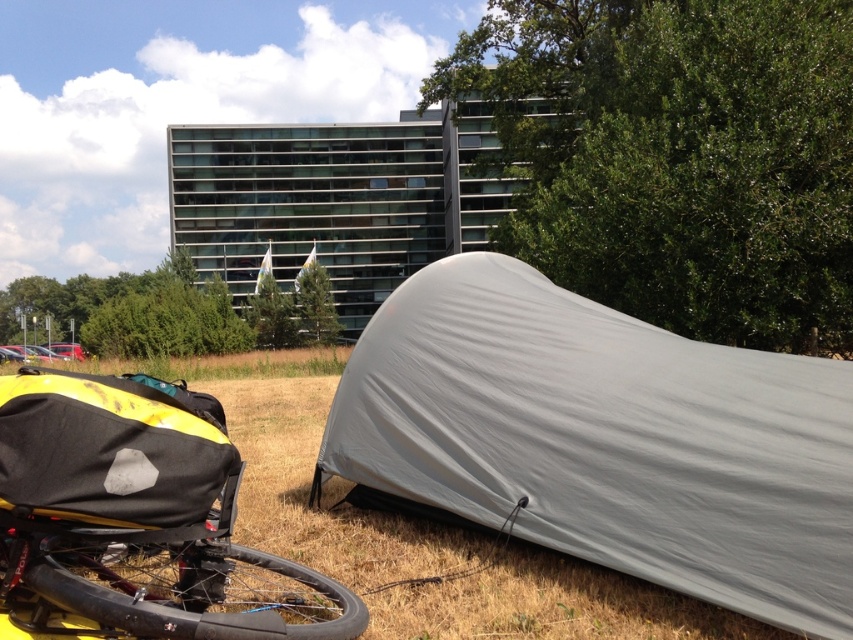
Question: Which object is farther from the camera taking this photo?

Choices:
 (A) gray fabric tent at lower right
 (B) green grass at lower center
 (C) yellow matte bicycle at lower left

Answer: (B)

Question: Among these objects, which one is farthest from the camera?

Choices:
 (A) gray fabric tent at lower right
 (B) green grass at lower center
 (C) black rubber tire at lower left

Answer: (B)

Question: Which point is closer to the camera?

Choices:
 (A) yellow matte bicycle at lower left
 (B) green grass at lower center

Answer: (A)

Question: Can you confirm if green grass at lower center is smaller than black rubber tire at lower left?

Choices:
 (A) yes
 (B) no

Answer: (B)

Question: Can you confirm if gray fabric tent at lower right is positioned below yellow matte bicycle at lower left?

Choices:
 (A) no
 (B) yes

Answer: (A)

Question: Is the position of yellow matte bicycle at lower left more distant than that of black rubber tire at lower left?

Choices:
 (A) yes
 (B) no

Answer: (B)